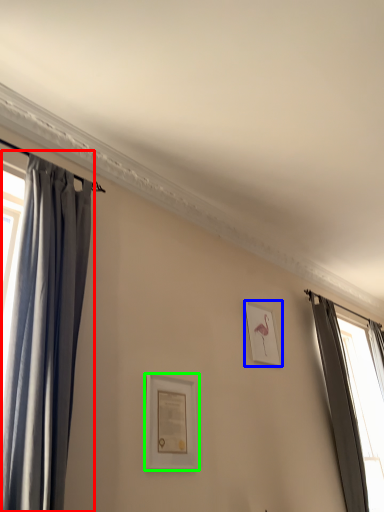
Question: Which object is the farthest from curtain (highlighted by a red box)? Choose among these: picture frame (highlighted by a blue box) or picture frame (highlighted by a green box).

Choices:
 (A) picture frame
 (B) picture frame

Answer: (A)